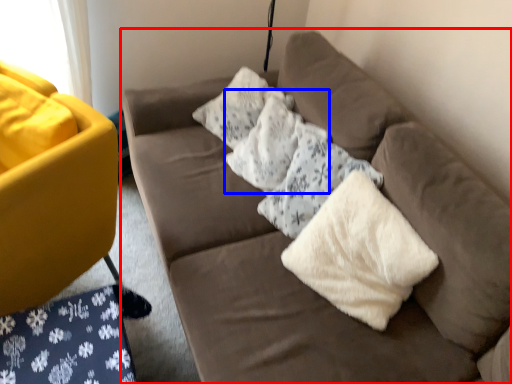
Question: Which object is further to the camera taking this photo, studio couch (highlighted by a red box) or pillow (highlighted by a blue box)?

Choices:
 (A) studio couch
 (B) pillow

Answer: (B)